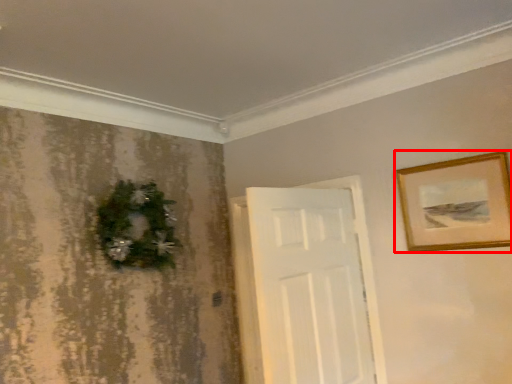
Question: From the image's perspective, where is picture frame (annotated by the red box) located relative to christmas decoration?

Choices:
 (A) above
 (B) below

Answer: (A)